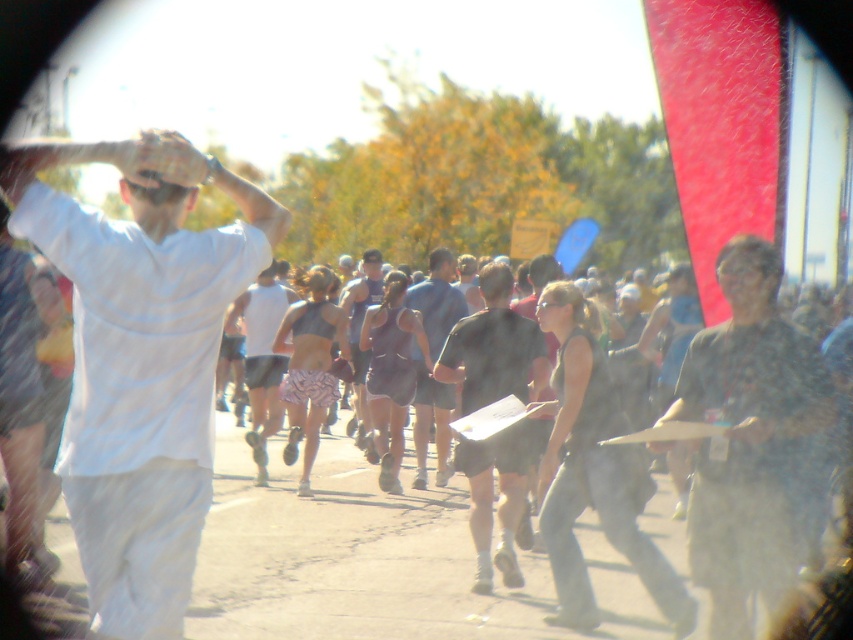
You are a runner participating in a marathon and you see the gray asphalt pavement at center and the matte gray tank top at center. Which object is wider?

The gray asphalt pavement at center is wider than the matte gray tank top at center.

You are a photographer at the marathon event. You want to capture a photo of the black matte shorts at center and dark gray tank top at center. Which one should you zoom in on to get a clearer image of the smaller clothing item?

The black matte shorts at center is smaller than the dark gray tank top at center, so you should zoom in on the black matte shorts at center to get a clearer image of the smaller clothing item.

You are a photographer at the marathon event. You want to capture a photo that highlights both the white matte shirt at left and the dark blue shirt at center. Considering their sizes in the frame, which shirt should you focus on to ensure both are clearly visible?

The white matte shirt at left occupies less space than the dark blue shirt at center, so focusing on the dark blue shirt at center would allow both to be clearly visible since it takes up more of the frame.